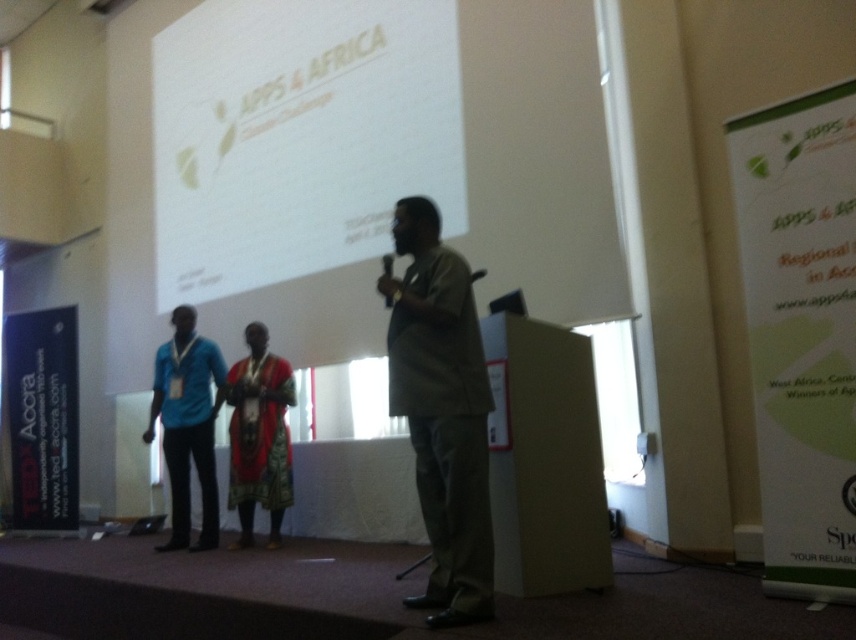
Does green fabric shirt at center have a larger size compared to textured red dress at center?

Indeed, green fabric shirt at center has a larger size compared to textured red dress at center.

Which of these two, green fabric shirt at center or textured red dress at center, stands taller?

Standing taller between the two is green fabric shirt at center.

The width and height of the screenshot is (856, 640). Describe the element at coordinates (443, 412) in the screenshot. I see `green fabric shirt at center` at that location.

Where is `green fabric shirt at center`? The height and width of the screenshot is (640, 856). green fabric shirt at center is located at coordinates (443, 412).

Can you confirm if white matte projection screen at upper center is positioned below blue fabric shirt at left?

No, white matte projection screen at upper center is not below blue fabric shirt at left.

The width and height of the screenshot is (856, 640). I want to click on white matte projection screen at upper center, so click(298, 136).

Who is more distant from viewer, (247, 266) or (152, 417)?

Positioned behind is point (247, 266).

Identify the location of white matte projection screen at upper center. 298,136.

Who is positioned more to the right, green fabric shirt at center or blue fabric shirt at left?

green fabric shirt at center is more to the right.

What do you see at coordinates (443, 412) in the screenshot?
I see `green fabric shirt at center` at bounding box center [443, 412].

Locate an element on the screen. green fabric shirt at center is located at coordinates 443,412.